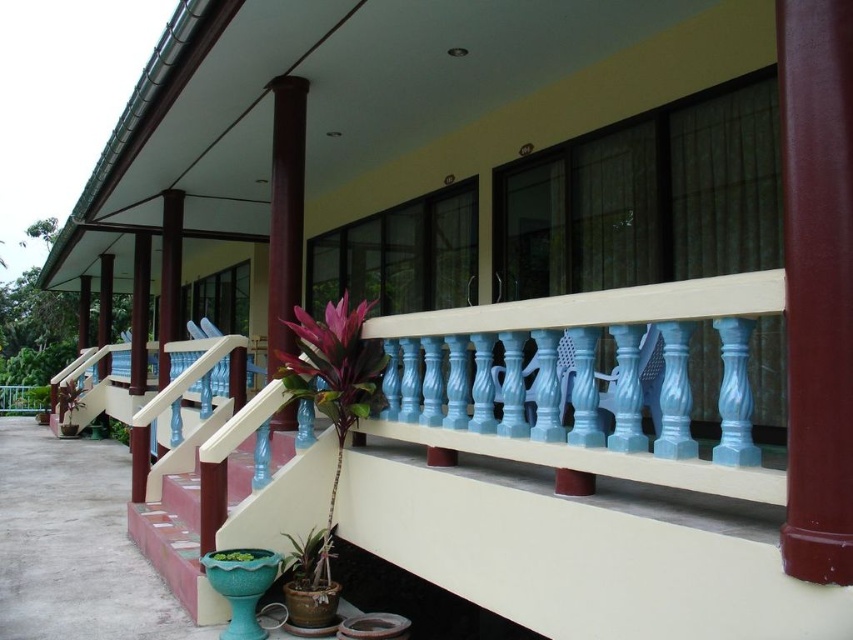
Question: Does smooth terracotta stairs at center appear on the left side of brown polished wood column at center?

Choices:
 (A) yes
 (B) no

Answer: (A)

Question: Which point appears closest to the camera in this image?

Choices:
 (A) (242, 554)
 (B) (299, 573)
 (C) (335, 378)

Answer: (A)

Question: Which point is closer to the camera?

Choices:
 (A) brown polished wood column at center
 (B) shiny green leaf at center

Answer: (B)

Question: Is smooth terracotta stairs at center positioned in front of brown polished wood column at center?

Choices:
 (A) no
 (B) yes

Answer: (B)

Question: Which object appears farthest from the camera in this image?

Choices:
 (A) shiny green leaf at center
 (B) green glossy plant at lower left
 (C) green leafy plant at lower left
 (D) brown polished wood column at center

Answer: (B)

Question: Can you confirm if brown polished wood column at center is positioned to the left of green matte planter at lower center?

Choices:
 (A) yes
 (B) no

Answer: (A)